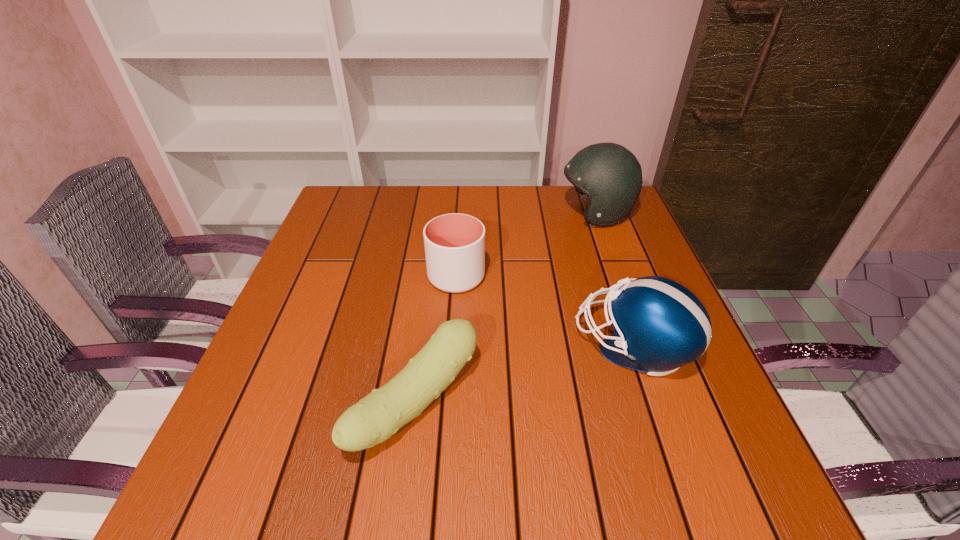
The image size is (960, 540). I want to click on free space located 0.360m at the front of the third shortest object with the faceguard, so point(401,346).

In order to click on free space located 0.350m at the front of the third shortest object with the faceguard in this screenshot , I will do `click(406, 346)`.

The width and height of the screenshot is (960, 540). I want to click on vacant space located 0.170m at the front of the third shortest object with the faceguard, so click(x=494, y=346).

The image size is (960, 540). What are the coordinates of `vacant space located 0.140m on the back of the cup` in the screenshot? It's located at (460, 227).

Image resolution: width=960 pixels, height=540 pixels. I want to click on vacant space located 0.360m on the back of the shortest object, so click(436, 244).

Locate an element on the screen. object present at the far edge is located at coordinates (609, 176).

Identify the location of object located at the near edge. (375, 418).

Where is `object located in the far right corner section of the desktop`? Image resolution: width=960 pixels, height=540 pixels. object located in the far right corner section of the desktop is located at coordinates (609, 176).

Image resolution: width=960 pixels, height=540 pixels. Find the location of `free region at the far edge of the desktop`. free region at the far edge of the desktop is located at coordinates (421, 185).

This screenshot has height=540, width=960. Find the location of `vacant space at the near edge`. vacant space at the near edge is located at coordinates (576, 469).